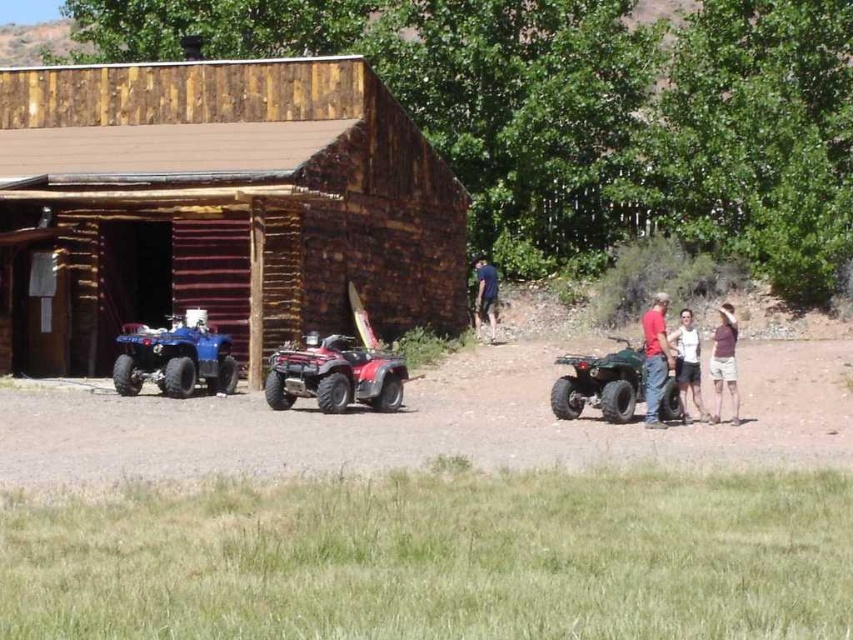
Can you confirm if matte red shirt at right is shorter than white cotton shirt at right?

No, matte red shirt at right is not shorter than white cotton shirt at right.

Find the location of a particular element. The width and height of the screenshot is (853, 640). matte red shirt at right is located at coordinates (654, 358).

Does matte red shirt at right appear under purple cotton shirt at right?

Actually, matte red shirt at right is above purple cotton shirt at right.

Is matte red shirt at right bigger than purple cotton shirt at right?

Actually, matte red shirt at right might be smaller than purple cotton shirt at right.

Is point (642, 326) positioned behind point (735, 417)?

Yes, point (642, 326) is behind point (735, 417).

At what (x,y) coordinates should I click in order to perform the action: click on matte red shirt at right. Please return your answer as a coordinate pair (x, y). The image size is (853, 640). Looking at the image, I should click on (654, 358).

Can you confirm if dirt track at center is positioned to the left of dark blue fabric at center?

In fact, dirt track at center is to the right of dark blue fabric at center.

Describe the element at coordinates (424, 424) in the screenshot. The height and width of the screenshot is (640, 853). I see `dirt track at center` at that location.

At what (x,y) coordinates should I click in order to perform the action: click on dirt track at center. Please return your answer as a coordinate pair (x, y). The image size is (853, 640). Looking at the image, I should click on (424, 424).

This screenshot has height=640, width=853. I want to click on dirt track at center, so click(x=424, y=424).